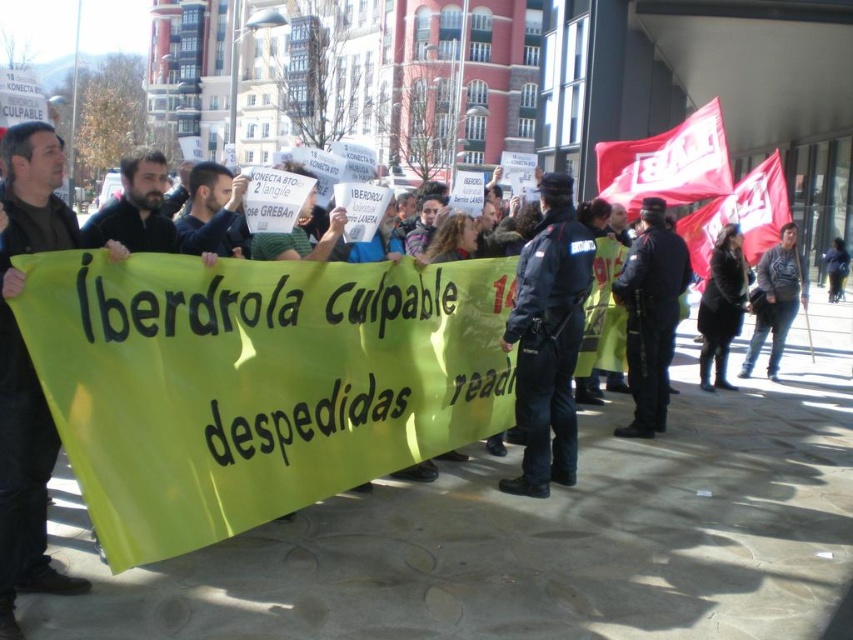
Who is more forward, (703, 323) or (780, 314)?

Point (703, 323) is more forward.

Is black leather jacket at center above dark gray sweater at center?

Actually, black leather jacket at center is below dark gray sweater at center.

You are a GUI agent. You are given a task and a screenshot of the screen. Output one action in this format:
    pyautogui.click(x=<x>, y=<y>)
    Task: Click on the black leather jacket at center
    The height and width of the screenshot is (640, 853).
    Given the screenshot: What is the action you would take?
    pyautogui.click(x=722, y=305)

Is point (32, 420) positioned in front of point (708, 314)?

Yes, point (32, 420) is closer to viewer.

Can you confirm if black fabric at left is positioned to the left of black leather jacket at center?

Indeed, black fabric at left is positioned on the left side of black leather jacket at center.

Identify the location of black fabric at left. (27, 371).

Is point (27, 353) behind point (756, 298)?

No, it is in front of (756, 298).

Measure the distance between black fabric at left and camera.

They are 40.47 feet apart.

Identify the location of black fabric at left. (27, 371).